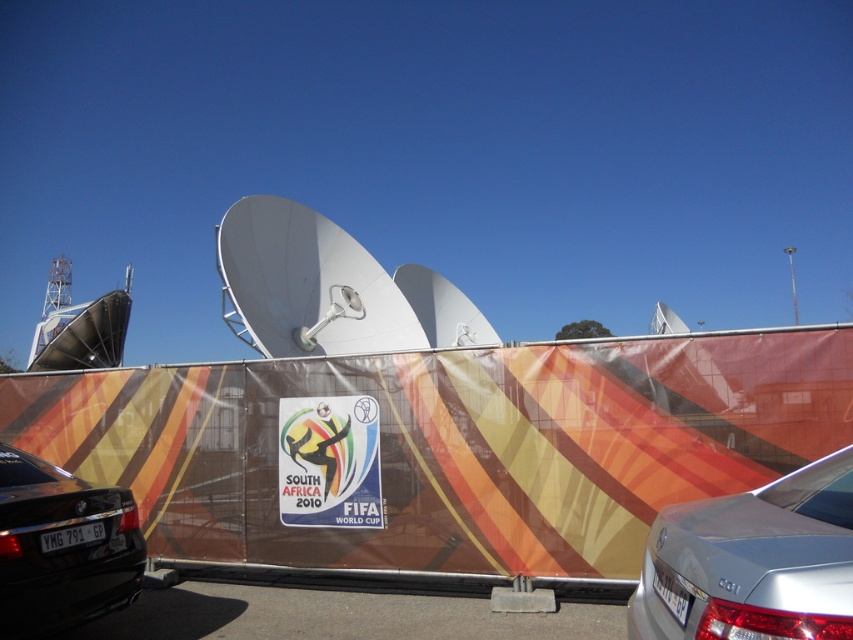
You are a delivery driver who needs to park your vehicle in the parking lot shown. You see the silver metallic sedan at lower right and the black plastic license plate at lower left. Which vehicle should you avoid parking too close to if you want to stay aligned with the parking spaces?

You should avoid parking too close to the silver metallic sedan at lower right because it is positioned to the right of the black plastic license plate at lower left, indicating it is closer to the edge of the parking space.

You are a delivery person trying to read license plates in the parking lot. You see the white plastic license plate at lower right and the black plastic license plate at lower left. Which license plate is positioned to the right side of the other?

The white plastic license plate at lower right is positioned to the right of the black plastic license plate at lower left.

You are a delivery person trying to park your van in the parking lot. You see the silver metallic sedan at lower right and the black plastic license plate at lower left. Which vehicle should you avoid parking too close to if you want to leave first?

You should avoid parking too close to the silver metallic sedan at lower right because it is larger in size than the black plastic license plate at lower left, making it harder to maneuver around.